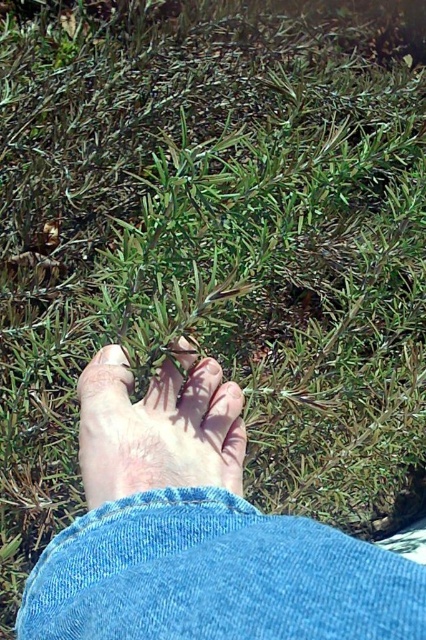
Can you confirm if smooth skin foot at center is wider than pale skin foot at center?

Indeed, smooth skin foot at center has a greater width compared to pale skin foot at center.

Is point (173, 611) positioned in front of point (224, 387)?

Yes, point (173, 611) is in front of point (224, 387).

You are a GUI agent. You are given a task and a screenshot of the screen. Output one action in this format:
    pyautogui.click(x=<x>, y=<y>)
    Task: Click on the smooth skin foot at center
    
    Given the screenshot: What is the action you would take?
    pyautogui.click(x=198, y=532)